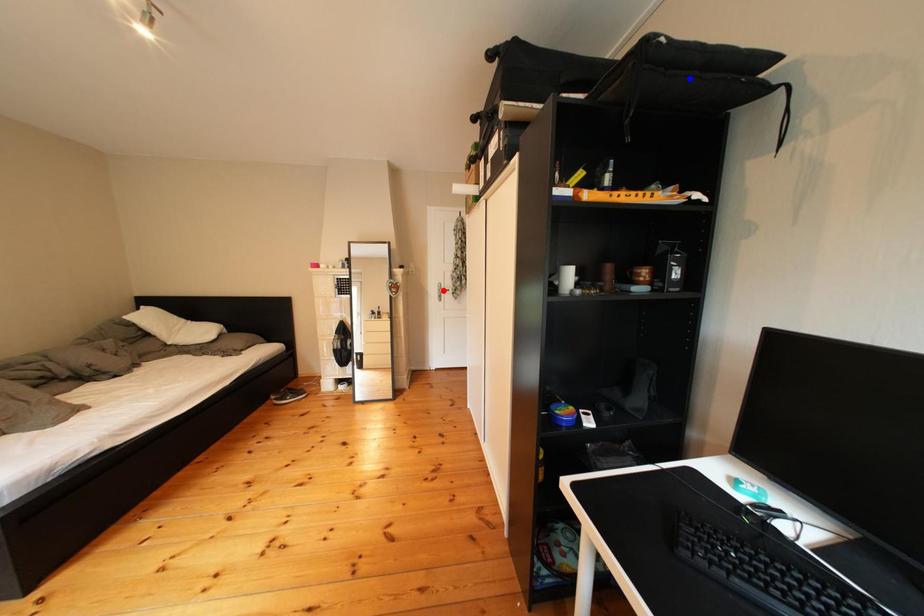
Question: Which of the two points in the image is closer to the camera?

Choices:
 (A) Blue point is closer.
 (B) Red point is closer.

Answer: (A)